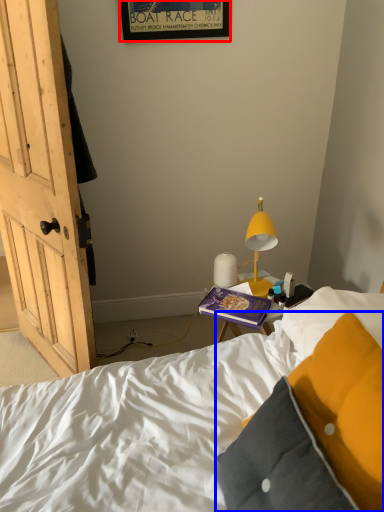
Question: Which object is further to the camera taking this photo, picture frame (highlighted by a red box) or pillow (highlighted by a blue box)?

Choices:
 (A) picture frame
 (B) pillow

Answer: (A)